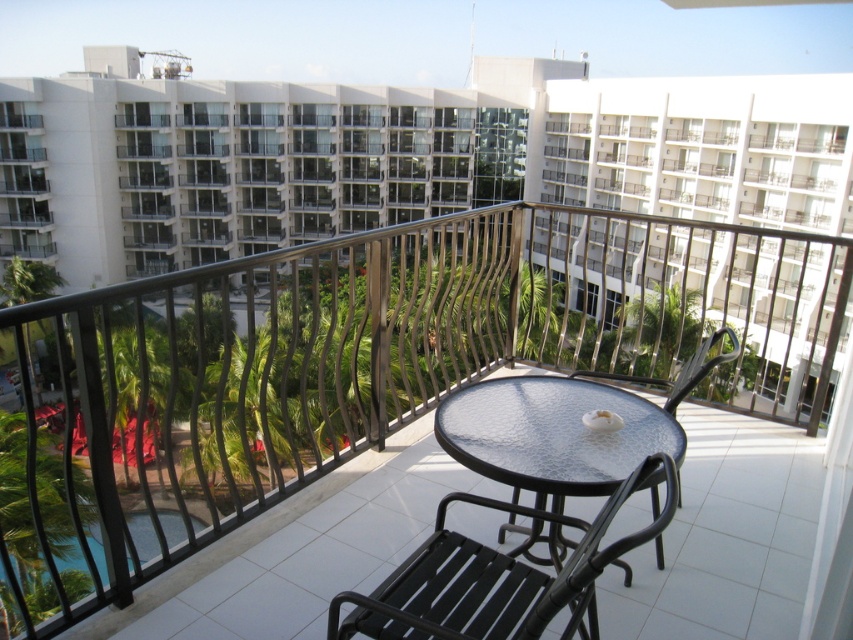
Is point (654, 480) positioned before point (9, 618)?

Yes, it is.

Can you confirm if textured glass table at center is wider than clear glass pool at lower left?

In fact, textured glass table at center might be narrower than clear glass pool at lower left.

Which is behind, point (575, 403) or point (0, 595)?

Positioned behind is point (0, 595).

What are the coordinates of `textured glass table at center` in the screenshot? It's located at (553, 442).

Does textured glass table at center appear over black metal chair at lower right?

Correct, textured glass table at center is located above black metal chair at lower right.

Does textured glass table at center have a lesser height compared to black metal chair at lower right?

Yes.

The height and width of the screenshot is (640, 853). Find the location of `textured glass table at center`. textured glass table at center is located at coordinates (553, 442).

Can you confirm if black metal chair at lower right is positioned to the left of clear glass pool at lower left?

In fact, black metal chair at lower right is to the right of clear glass pool at lower left.

From the picture: Does black metal chair at lower right lie behind clear glass pool at lower left?

No, it is in front of clear glass pool at lower left.

Does point (399, 637) come farther from viewer compared to point (132, 515)?

No, it is not.

The height and width of the screenshot is (640, 853). I want to click on black metal chair at lower right, so click(494, 577).